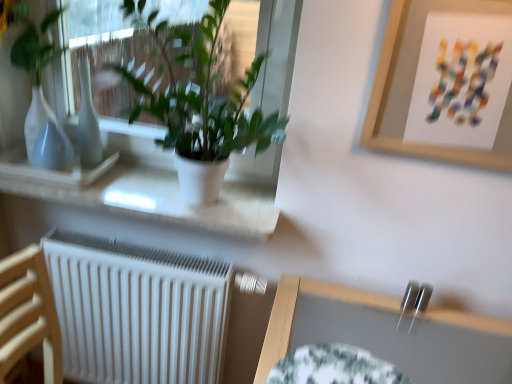
The height and width of the screenshot is (384, 512). Describe the element at coordinates (412, 86) in the screenshot. I see `wooden picture frame at upper right` at that location.

What do you see at coordinates (201, 106) in the screenshot?
I see `white matte plant pot at upper left, which is the first houseplant in right-to-left order` at bounding box center [201, 106].

Locate an element on the screen. white matte radiator at lower left is located at coordinates (137, 311).

In order to face matte white vase at left, acting as the second vase starting from the right, should I rotate leftwards or rightwards?

Rotate your view left by about 25.542°.

At what (x,y) coordinates should I click in order to perform the action: click on white glossy vase at left, which is the 1th houseplant from left to right. Please return your answer as a coordinate pair (x, y). The height and width of the screenshot is (384, 512). Looking at the image, I should click on (38, 86).

Can you confirm if matte white vase at left, the 1th vase in the left-to-right sequence, is taller than white matte window sill at upper left?

Correct, matte white vase at left, the 1th vase in the left-to-right sequence, is much taller as white matte window sill at upper left.

Does matte white vase at left, acting as the second vase starting from the right, have a lesser width compared to white matte window sill at upper left?

Yes.

Which is more to the right, matte white vase at left, the 1th vase in the left-to-right sequence, or white matte window sill at upper left?

Positioned to the right is white matte window sill at upper left.

Is white matte plant pot at upper left, acting as the 2th houseplant starting from the left, at the back of white matte window sill at upper left?

No, white matte window sill at upper left's orientation is not away from white matte plant pot at upper left, acting as the 2th houseplant starting from the left.

From a real-world perspective, between white matte window sill at upper left and white matte plant pot at upper left, acting as the 2th houseplant starting from the left, who is vertically higher?

white matte plant pot at upper left, acting as the 2th houseplant starting from the left, is physically above.

Which of these two, white matte window sill at upper left or white matte plant pot at upper left, which is the first houseplant in right-to-left order, stands taller?

With more height is white matte plant pot at upper left, which is the first houseplant in right-to-left order.

Is white matte window sill at upper left with white matte plant pot at upper left, which is the first houseplant in right-to-left order?

No.

Is point (52, 150) more distant than point (51, 160)?

Yes, it is behind point (51, 160).

Which is correct: white glossy vase at left, which is the 1th houseplant from left to right, is inside matte white vase at left, acting as the second vase starting from the right, or outside of it?

white glossy vase at left, which is the 1th houseplant from left to right, is not enclosed by matte white vase at left, acting as the second vase starting from the right.

From the image's perspective, which object appears higher, white glossy vase at left, which is the 1th houseplant from left to right, or matte white vase at left, acting as the second vase starting from the right?

white glossy vase at left, which is the 1th houseplant from left to right, from the image's perspective.

Based on their sizes in the image, would you say white glossy vase at left, the 2th houseplant when ordered from right to left, is bigger or smaller than matte white vase at left, acting as the second vase starting from the right?

Considering their sizes, white glossy vase at left, the 2th houseplant when ordered from right to left, takes up more space than matte white vase at left, acting as the second vase starting from the right.

From the image's perspective, which is below, matte white vase at left, the 1th vase in the left-to-right sequence, or wooden picture frame at upper right?

From the image's view, matte white vase at left, the 1th vase in the left-to-right sequence, is below.

From a real-world perspective, between matte white vase at left, acting as the second vase starting from the right, and wooden picture frame at upper right, who is vertically lower?

matte white vase at left, acting as the second vase starting from the right, from a real-world perspective.

Is matte white vase at left, acting as the second vase starting from the right, closer to the viewer compared to wooden picture frame at upper right?

That is False.

Based on the photo, from a real-world perspective, who is located higher, matte white vase at left, acting as the second vase starting from the right, or white matte plant pot at upper left, which is the first houseplant in right-to-left order?

white matte plant pot at upper left, which is the first houseplant in right-to-left order.

Starting from the white matte plant pot at upper left, which is the first houseplant in right-to-left order, which vase is the 1st one behind? Please provide its 2D coordinates.

[(53, 148)]

Which of these two, matte white vase at left, the 1th vase in the left-to-right sequence, or white matte plant pot at upper left, which is the first houseplant in right-to-left order, stands taller?

With more height is white matte plant pot at upper left, which is the first houseplant in right-to-left order.

Considering the relative positions of matte white vase at left, the 1th vase in the left-to-right sequence, and white matte plant pot at upper left, which is the first houseplant in right-to-left order, in the image provided, is matte white vase at left, the 1th vase in the left-to-right sequence, to the left of white matte plant pot at upper left, which is the first houseplant in right-to-left order, from the viewer's perspective?

Indeed, matte white vase at left, the 1th vase in the left-to-right sequence, is positioned on the left side of white matte plant pot at upper left, which is the first houseplant in right-to-left order.

From a real-world perspective, does matte white vase at left, the 1th vase in the left-to-right sequence, sit lower than white glossy vase at upper left, the first vase when ordered from right to left?

Yes, from a real-world perspective, matte white vase at left, the 1th vase in the left-to-right sequence, is under white glossy vase at upper left, the first vase when ordered from right to left.

Is matte white vase at left, acting as the second vase starting from the right, facing away from white glossy vase at upper left, the first vase when ordered from right to left?

Yes, white glossy vase at upper left, the first vase when ordered from right to left, is at the back of matte white vase at left, acting as the second vase starting from the right.

Considering the sizes of matte white vase at left, acting as the second vase starting from the right, and white glossy vase at upper left, the first vase when ordered from right to left, in the image, is matte white vase at left, acting as the second vase starting from the right, taller or shorter than white glossy vase at upper left, the first vase when ordered from right to left,?

In the image, matte white vase at left, acting as the second vase starting from the right, appears to be shorter than white glossy vase at upper left, the first vase when ordered from right to left.

Looking at this image, from the image's perspective, who appears lower, matte white vase at left, the 1th vase in the left-to-right sequence, or white glossy vase at upper left, the second vase in the left-to-right sequence?

From the image's view, matte white vase at left, the 1th vase in the left-to-right sequence, is below.

Is white glossy vase at left, the 2th houseplant when ordered from right to left, looking in the opposite direction of white matte window sill at upper left?

No, white glossy vase at left, the 2th houseplant when ordered from right to left, is not facing the opposite direction of white matte window sill at upper left.

Is white glossy vase at left, the 2th houseplant when ordered from right to left, far from white matte window sill at upper left?

No, there isn't a large distance between white glossy vase at left, the 2th houseplant when ordered from right to left, and white matte window sill at upper left.

From the image's perspective, relative to white matte window sill at upper left, is white glossy vase at left, the 2th houseplant when ordered from right to left, above or below?

white glossy vase at left, the 2th houseplant when ordered from right to left, is above white matte window sill at upper left.

From a real-world perspective, is white glossy vase at left, the 2th houseplant when ordered from right to left, located beneath white matte window sill at upper left?

No.

Locate an element on the screen. This screenshot has height=384, width=512. the 2nd vase to the left when counting from the white matte window sill at upper left is located at coordinates (53, 148).

Where is `houseplant lying on the right of white matte window sill at upper left`? The height and width of the screenshot is (384, 512). houseplant lying on the right of white matte window sill at upper left is located at coordinates (201, 106).

When comparing their distances from white matte plant pot at upper left, acting as the 2th houseplant starting from the left, does white matte window sill at upper left or matte white vase at left, the 1th vase in the left-to-right sequence, seem further?

matte white vase at left, the 1th vase in the left-to-right sequence, is further to white matte plant pot at upper left, acting as the 2th houseplant starting from the left.

Consider the image. Which object lies nearer to the anchor point white matte plant pot at upper left, which is the first houseplant in right-to-left order, white matte window sill at upper left or white glossy vase at upper left, the second vase in the left-to-right sequence?

white matte window sill at upper left.

Which object lies nearer to the anchor point white matte plant pot at upper left, which is the first houseplant in right-to-left order, white matte radiator at lower left or wooden picture frame at upper right?

wooden picture frame at upper right is closer to white matte plant pot at upper left, which is the first houseplant in right-to-left order.

Looking at this image, from the image, which object appears to be nearer to matte white vase at left, acting as the second vase starting from the right, white matte window sill at upper left or white matte plant pot at upper left, acting as the 2th houseplant starting from the left?

The object closer to matte white vase at left, acting as the second vase starting from the right, is white matte window sill at upper left.

Looking at the image, which one is located further to white glossy vase at upper left, the second vase in the left-to-right sequence, white matte plant pot at upper left, which is the first houseplant in right-to-left order, or matte white vase at left, the 1th vase in the left-to-right sequence?

white matte plant pot at upper left, which is the first houseplant in right-to-left order, is further to white glossy vase at upper left, the second vase in the left-to-right sequence.

From the image, which object appears to be farther from wooden picture frame at upper right, white glossy vase at upper left, the second vase in the left-to-right sequence, or white matte plant pot at upper left, which is the first houseplant in right-to-left order?

Among the two, white glossy vase at upper left, the second vase in the left-to-right sequence, is located further to wooden picture frame at upper right.

Estimate the real-world distances between objects in this image. Which object is closer to white matte radiator at lower left, white glossy vase at left, which is the 1th houseplant from left to right, or white glossy vase at upper left, the second vase in the left-to-right sequence?

white glossy vase at upper left, the second vase in the left-to-right sequence, lies closer to white matte radiator at lower left than the other object.

From the image, which object appears to be farther from wooden picture frame at upper right, white matte plant pot at upper left, acting as the 2th houseplant starting from the left, or matte white vase at left, the 1th vase in the left-to-right sequence?

matte white vase at left, the 1th vase in the left-to-right sequence.

Where is `radiator situated between matte white vase at left, acting as the second vase starting from the right, and wooden picture frame at upper right from left to right`? The width and height of the screenshot is (512, 384). radiator situated between matte white vase at left, acting as the second vase starting from the right, and wooden picture frame at upper right from left to right is located at coordinates (137, 311).

Find the location of a particular element. The height and width of the screenshot is (384, 512). window sill between white matte plant pot at upper left, which is the first houseplant in right-to-left order, and white glossy vase at upper left, the first vase when ordered from right to left, along the z-axis is located at coordinates (161, 193).

Where is `houseplant between white matte radiator at lower left and wooden picture frame at upper right from left to right`? This screenshot has height=384, width=512. houseplant between white matte radiator at lower left and wooden picture frame at upper right from left to right is located at coordinates (201, 106).

Find the location of a particular element. This screenshot has height=384, width=512. houseplant between white matte window sill at upper left and wooden picture frame at upper right in the horizontal direction is located at coordinates (201, 106).